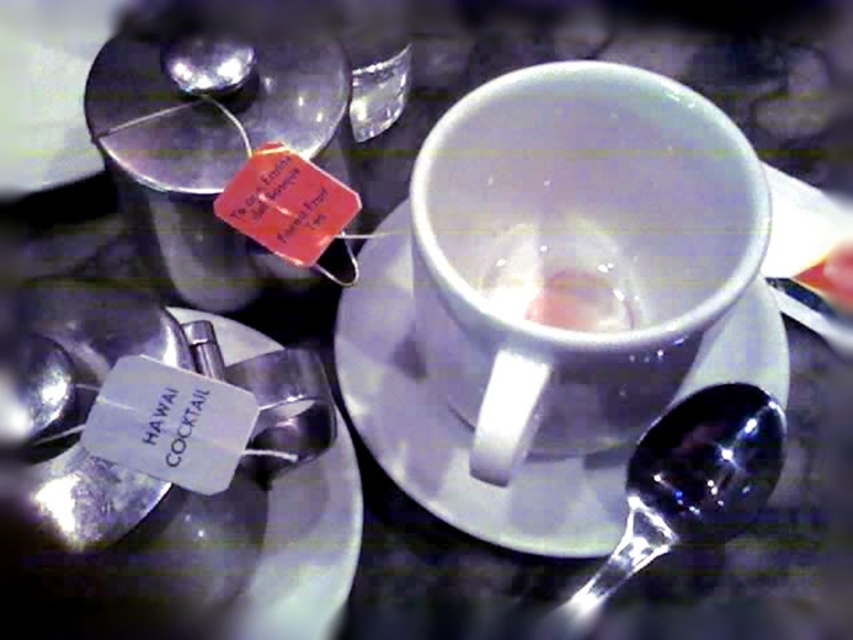
You are setting up a tea station and need to place a decorative item between the white paper tag at lower left and the clear glass cup at center. What is the minimum distance you should keep between them to ensure the item fits?

The white paper tag at lower left and clear glass cup at center are 25.01 centimeters apart, so the decorative item should be placed at least 25.01 centimeters away from both to fit between them.